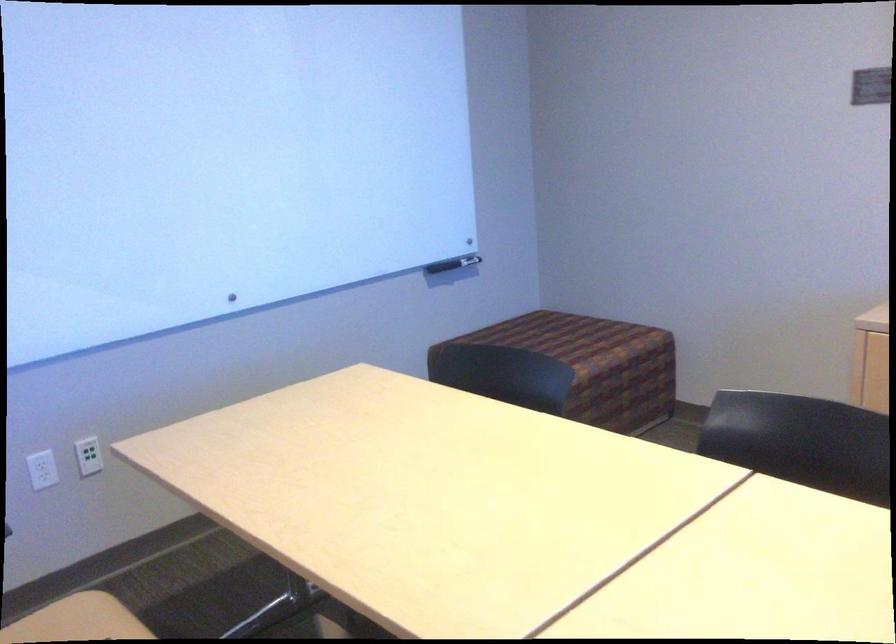
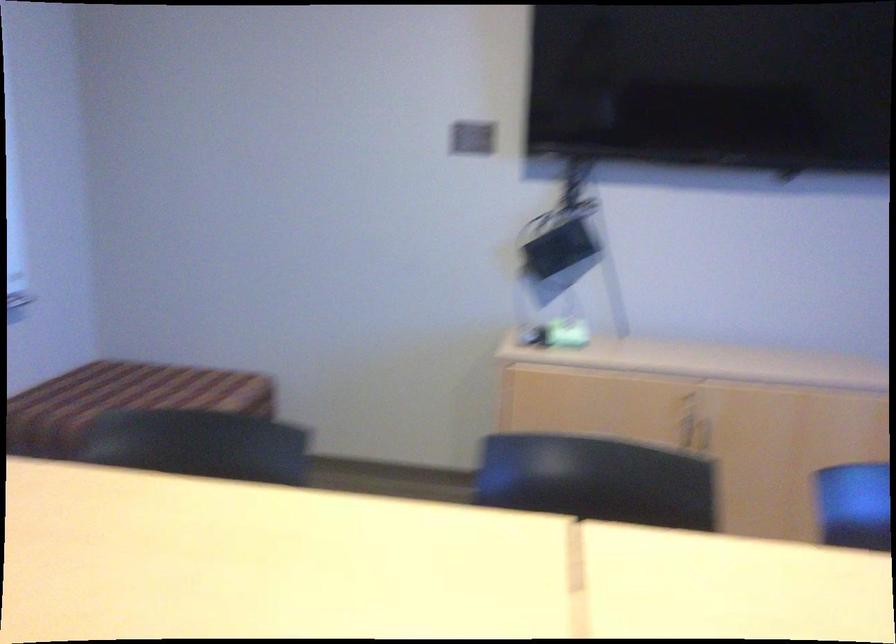
Question: The camera is either moving clockwise (left) or counter-clockwise (right) around the object. The first image is from the beginning of the video and the second image is from the end. Is the camera moving left or right when shooting the video?

Choices:
 (A) Left
 (B) Right

Answer: (A)